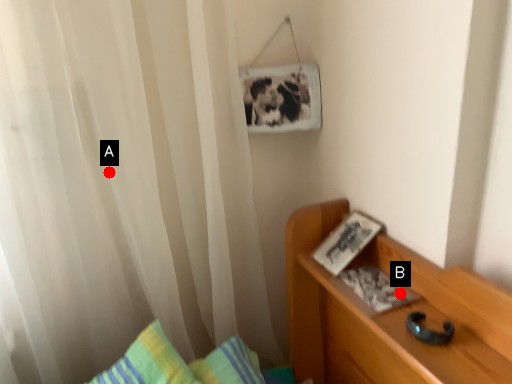
Question: Two points are circled on the image, labeled by A and B beside each circle. Which point is closer to the camera?

Choices:
 (A) A is closer
 (B) B is closer

Answer: (B)